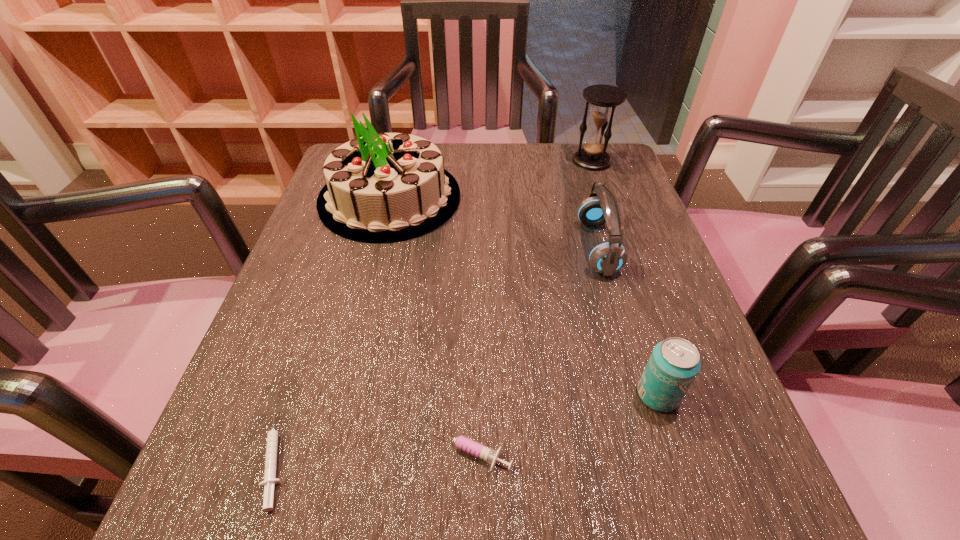
Where is `vacant space located 0.100m on the ear cups of the headset`? vacant space located 0.100m on the ear cups of the headset is located at coordinates (532, 247).

Locate an element on the screen. The width and height of the screenshot is (960, 540). free space located 0.260m on the ear cups of the headset is located at coordinates (454, 247).

At what (x,y) coordinates should I click in order to perform the action: click on free space located 0.170m on the ear cups of the headset. Please return your answer as a coordinate pair (x, y). Looking at the image, I should click on (497, 247).

Find the location of a particular element. This screenshot has width=960, height=540. free location located on the left of the third shortest object is located at coordinates (492, 395).

Identify the location of blank space located 0.050m on the front of the right syringe. The height and width of the screenshot is (540, 960). (467, 515).

Identify the location of vacant area situated 0.060m on the right of the left syringe. The width and height of the screenshot is (960, 540). (335, 458).

What are the coordinates of `birthday cake located in the far edge section of the desktop` in the screenshot? It's located at (382, 187).

Where is `hourglass at the far edge`? This screenshot has height=540, width=960. hourglass at the far edge is located at coordinates tap(604, 98).

Find the location of `birthday cake that is at the left edge`. birthday cake that is at the left edge is located at coordinates (382, 187).

Identify the location of syringe located at the left edge. (270, 480).